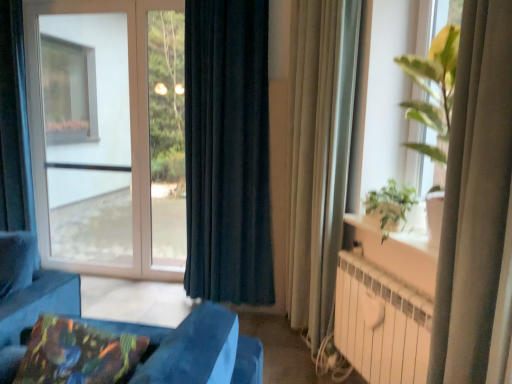
You are a GUI agent. You are given a task and a screenshot of the screen. Output one action in this format:
    pyautogui.click(x=<x>, y=<y>)
    Task: Click on the transparent glass window at left, the first window in the left-to-right sequence
    
    Given the screenshot: What is the action you would take?
    pyautogui.click(x=108, y=135)

Looking at this image, measure the distance between point [167,154] and camera.

5.50 meters.

The height and width of the screenshot is (384, 512). What do you see at coordinates (313, 161) in the screenshot? I see `beige fabric curtain at right, which appears as the 2th curtain when viewed from the front` at bounding box center [313, 161].

The image size is (512, 384). Describe the element at coordinates (390, 206) in the screenshot. I see `green leafy plant at right` at that location.

This screenshot has width=512, height=384. What do you see at coordinates (227, 152) in the screenshot? I see `dark blue fabric curtain at center, the 3th curtain from the right` at bounding box center [227, 152].

You are a GUI agent. You are given a task and a screenshot of the screen. Output one action in this format:
    pyautogui.click(x=<x>, y=<y>)
    Task: Click on the transparent glass window at left, the first window in the left-to-right sequence
    The height and width of the screenshot is (384, 512).
    Given the screenshot: What is the action you would take?
    pyautogui.click(x=108, y=135)

Based on their positions, is transparent glass window at left, which appears as the first window when viewed from the back, located to the left or right of green leafy plant at upper right, positioned as the first window in front-to-back order?

In the image, transparent glass window at left, which appears as the first window when viewed from the back, appears on the left side of green leafy plant at upper right, positioned as the first window in front-to-back order.

Is transparent glass window at left, which is the second window from right to left, closer to camera compared to green leafy plant at upper right, positioned as the first window in front-to-back order?

No, the depth of transparent glass window at left, which is the second window from right to left, is greater than that of green leafy plant at upper right, positioned as the first window in front-to-back order.

Can you confirm if transparent glass window at left, which is the second window from right to left, is shorter than green leafy plant at upper right, which is the 2th window in back-to-front order?

In fact, transparent glass window at left, which is the second window from right to left, may be taller than green leafy plant at upper right, which is the 2th window in back-to-front order.

Considering the sizes of objects transparent glass window at left, the second window when ordered from front to back, and green leafy plant at upper right, which is the 2th window in back-to-front order, in the image provided, who is bigger, transparent glass window at left, the second window when ordered from front to back, or green leafy plant at upper right, which is the 2th window in back-to-front order,?

green leafy plant at upper right, which is the 2th window in back-to-front order, is bigger.

Does point (411, 304) lie in front of point (87, 23)?

Yes, it is in front of point (87, 23).

Looking at their sizes, would you say white metallic radiator at lower right is wider or thinner than transparent glass window at left, which appears as the first window when viewed from the back?

Considering their sizes, white metallic radiator at lower right looks broader than transparent glass window at left, which appears as the first window when viewed from the back.

Could you tell me if white metallic radiator at lower right is facing transparent glass window at left, the first window in the left-to-right sequence?

No, white metallic radiator at lower right does not turn towards transparent glass window at left, the first window in the left-to-right sequence.

Is white metallic radiator at lower right taller than transparent glass window at left, which is the second window from right to left?

In fact, white metallic radiator at lower right may be shorter than transparent glass window at left, which is the second window from right to left.

Image resolution: width=512 pixels, height=384 pixels. I want to click on houseplant below the transparent glass window at left, which is the second window from right to left (from the image's perspective), so click(390, 206).

From the image's perspective, is green leafy plant at right located above or below transparent glass window at left, the second window when ordered from front to back?

Clearly, from the image's perspective, green leafy plant at right is below transparent glass window at left, the second window when ordered from front to back.

Between green leafy plant at right and transparent glass window at left, which is the second window from right to left, which one has larger size?

With larger size is transparent glass window at left, which is the second window from right to left.

Is point (388, 191) closer or farther from the camera than point (139, 163)?

Point (388, 191) is closer to the camera than point (139, 163).

Consider the image. How many degrees apart are the facing directions of dark blue fabric curtain at center, the third curtain in the front-to-back sequence, and beige sheer curtain at right, arranged as the first curtain when viewed from the right?

59.8 degrees separate the facing orientations of dark blue fabric curtain at center, the third curtain in the front-to-back sequence, and beige sheer curtain at right, arranged as the first curtain when viewed from the right.

From a real-world perspective, is dark blue fabric curtain at center, the 3th curtain from the right, above or below beige sheer curtain at right, the first curtain from the front?

In terms of real-world spatial position, dark blue fabric curtain at center, the 3th curtain from the right, is above beige sheer curtain at right, the first curtain from the front.

Is dark blue fabric curtain at center, the 1th curtain from the left, beside beige sheer curtain at right, arranged as the first curtain when viewed from the right?

No, dark blue fabric curtain at center, the 1th curtain from the left, is not next to beige sheer curtain at right, arranged as the first curtain when viewed from the right.

Is point (202, 262) closer or farther from the camera than point (460, 275)?

Clearly, point (202, 262) is more distant from the camera than point (460, 275).

Does point (307, 32) lie behind point (42, 342)?

Yes, point (307, 32) is behind point (42, 342).

Is beige fabric curtain at right, the second curtain when ordered from left to right, aimed at multicolored fabric pillow at lower left?

No, beige fabric curtain at right, the second curtain when ordered from left to right, is not facing towards multicolored fabric pillow at lower left.

Is beige fabric curtain at right, the 2th curtain when ordered from back to front, positioned behind multicolored fabric pillow at lower left?

Yes, it is behind multicolored fabric pillow at lower left.

Does beige fabric curtain at right, which is the 2th curtain in right-to-left order, appear on the right side of multicolored fabric pillow at lower left?

Correct, you'll find beige fabric curtain at right, which is the 2th curtain in right-to-left order, to the right of multicolored fabric pillow at lower left.

Is dark blue fabric curtain at center, the 1th curtain from the left, looking in the opposite direction of beige fabric curtain at right, which is the 2th curtain in right-to-left order?

No, beige fabric curtain at right, which is the 2th curtain in right-to-left order, is not at the back of dark blue fabric curtain at center, the 1th curtain from the left.

Considering their positions, is dark blue fabric curtain at center, the 1th curtain from the left, located in front of or behind beige fabric curtain at right, which is the 2th curtain in right-to-left order?

Clearly, dark blue fabric curtain at center, the 1th curtain from the left, is behind beige fabric curtain at right, which is the 2th curtain in right-to-left order.

From a real-world perspective, is dark blue fabric curtain at center, the 3th curtain from the right, over beige fabric curtain at right, the 2th curtain when ordered from back to front?

Yes, from a real-world perspective, dark blue fabric curtain at center, the 3th curtain from the right, is above beige fabric curtain at right, the 2th curtain when ordered from back to front.

How much distance is there between dark blue fabric curtain at center, the third curtain in the front-to-back sequence, and beige fabric curtain at right, the 2th curtain when ordered from back to front?

The distance of dark blue fabric curtain at center, the third curtain in the front-to-back sequence, from beige fabric curtain at right, the 2th curtain when ordered from back to front, is 21.46 inches.

Is beige fabric curtain at right, the 2th curtain when ordered from back to front, not inside white metallic radiator at lower right?

Yes, beige fabric curtain at right, the 2th curtain when ordered from back to front, is not within white metallic radiator at lower right.

Which is more to the left, beige fabric curtain at right, the second curtain when ordered from left to right, or white metallic radiator at lower right?

Positioned to the left is beige fabric curtain at right, the second curtain when ordered from left to right.

How much distance is there between beige fabric curtain at right, the 2th curtain when ordered from back to front, and white metallic radiator at lower right?

The distance of beige fabric curtain at right, the 2th curtain when ordered from back to front, from white metallic radiator at lower right is 23.55 inches.

From a real-world perspective, is beige fabric curtain at right, the 2th curtain when ordered from back to front, over white metallic radiator at lower right?

Yes, from a real-world perspective, beige fabric curtain at right, the 2th curtain when ordered from back to front, is above white metallic radiator at lower right.

Find the location of a particular element. Image resolution: width=512 pixels, height=384 pixels. window lying below the transparent glass window at left, which appears as the first window when viewed from the back (from the image's perspective) is located at coordinates (433, 90).

I want to click on radiator that appears below the transparent glass window at left, the second window when ordered from front to back (from a real-world perspective), so click(x=381, y=324).

Considering their positions, is beige fabric curtain at right, which appears as the 2th curtain when viewed from the front, positioned further to green leafy plant at upper right, the 2th window viewed from the left, than dark blue fabric curtain at center, the 1th curtain from the back?

dark blue fabric curtain at center, the 1th curtain from the back, lies further to green leafy plant at upper right, the 2th window viewed from the left, than the other object.

Looking at the image, which one is located further to beige fabric curtain at right, which appears as the 2th curtain when viewed from the front, green leafy plant at right or multicolored fabric pillow at lower left?

Based on the image, multicolored fabric pillow at lower left appears to be further to beige fabric curtain at right, which appears as the 2th curtain when viewed from the front.

Based on their spatial positions, is transparent glass window at left, which is the second window from right to left, or green leafy plant at upper right, the 2th window viewed from the left, closer to beige sheer curtain at right, arranged as the first curtain when viewed from the right?

green leafy plant at upper right, the 2th window viewed from the left.

Which object lies further to the anchor point green leafy plant at upper right, the 2th window viewed from the left, white metallic radiator at lower right or beige fabric curtain at right, the 2th curtain when ordered from back to front?

beige fabric curtain at right, the 2th curtain when ordered from back to front.

Estimate the real-world distances between objects in this image. Which object is closer to green leafy plant at right, multicolored fabric pillow at lower left or dark blue fabric curtain at center, the third curtain in the front-to-back sequence?

Based on the image, dark blue fabric curtain at center, the third curtain in the front-to-back sequence, appears to be nearer to green leafy plant at right.

From the image, which object appears to be nearer to white metallic radiator at lower right, beige fabric curtain at right, the 2th curtain when ordered from back to front, or transparent glass window at left, the second window when ordered from front to back?

beige fabric curtain at right, the 2th curtain when ordered from back to front, lies closer to white metallic radiator at lower right than the other object.

In the scene shown: When comparing their distances from beige fabric curtain at right, the second curtain when ordered from left to right, does green leafy plant at right or green leafy plant at upper right, marked as the first window in a right-to-left arrangement, seem further?

Based on the image, green leafy plant at right appears to be further to beige fabric curtain at right, the second curtain when ordered from left to right.

Considering their positions, is beige sheer curtain at right, the third curtain from the back, positioned closer to white metallic radiator at lower right than beige fabric curtain at right, which appears as the 2th curtain when viewed from the front?

beige sheer curtain at right, the third curtain from the back.

Find the location of a particular element. The height and width of the screenshot is (384, 512). curtain between transparent glass window at left, the first window in the left-to-right sequence, and beige fabric curtain at right, the second curtain when ordered from left to right, in the horizontal direction is located at coordinates (227, 152).

Where is `houseplant between transparent glass window at left, the first window in the left-to-right sequence, and green leafy plant at upper right, which is the 2th window in back-to-front order, in the horizontal direction`? The image size is (512, 384). houseplant between transparent glass window at left, the first window in the left-to-right sequence, and green leafy plant at upper right, which is the 2th window in back-to-front order, in the horizontal direction is located at coordinates (390, 206).

I want to click on radiator between transparent glass window at left, the second window when ordered from front to back, and beige sheer curtain at right, the third curtain in the left-to-right sequence, from left to right, so click(x=381, y=324).

Image resolution: width=512 pixels, height=384 pixels. In order to click on radiator located between beige sheer curtain at right, the third curtain in the left-to-right sequence, and beige fabric curtain at right, the second curtain when ordered from left to right, in the depth direction in this screenshot , I will do `click(381, 324)`.